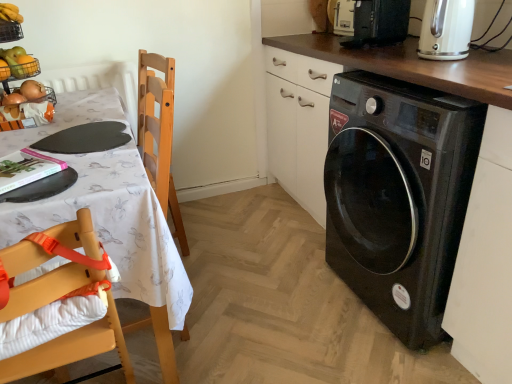
Question: From the image's perspective, is white fabric tablecloth at left located above or below wooden highchair at left?

Choices:
 (A) above
 (B) below

Answer: (A)

Question: Is point (99, 152) positioned closer to the camera than point (31, 283)?

Choices:
 (A) farther
 (B) closer

Answer: (A)

Question: Which object is the farthest from the black plastic microwave at upper right?

Choices:
 (A) wooden highchair at left
 (B) black glossy washing machine at lower right
 (C) metallic wire basket at upper left
 (D) cream matte electric kettle at upper right
 (E) white fabric tablecloth at left

Answer: (A)

Question: Which object is positioned farthest from the wooden highchair at left?

Choices:
 (A) cream matte electric kettle at upper right
 (B) black glossy washing machine at lower right
 (C) black plastic microwave at upper right
 (D) white fabric tablecloth at left
 (E) metallic wire basket at upper left

Answer: (C)